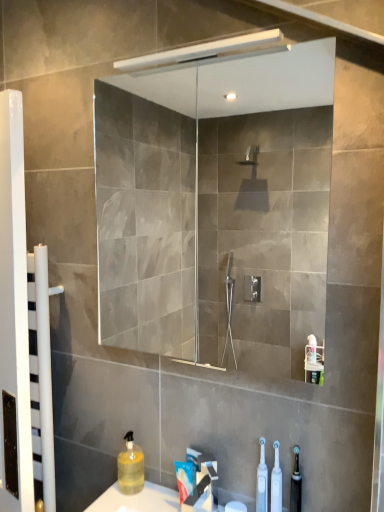
Question: Is white plastic toothbrushes at lower center, placed as the second toiletry when sorted from right to left, oriented towards transparent glass mirror at upper center?

Choices:
 (A) no
 (B) yes

Answer: (A)

Question: Considering the relative sizes of white plastic toothbrushes at lower center, acting as the first toiletry starting from the left, and transparent glass mirror at upper center in the image provided, is white plastic toothbrushes at lower center, acting as the first toiletry starting from the left, thinner than transparent glass mirror at upper center?

Choices:
 (A) no
 (B) yes

Answer: (B)

Question: From the image's perspective, is white plastic toothbrushes at lower center, acting as the first toiletry starting from the left, above transparent glass mirror at upper center?

Choices:
 (A) no
 (B) yes

Answer: (A)

Question: Is white plastic toothbrushes at lower center, acting as the first toiletry starting from the left, surrounding transparent glass mirror at upper center?

Choices:
 (A) no
 (B) yes

Answer: (A)

Question: Is white plastic toothbrushes at lower center, acting as the first toiletry starting from the left, placed right next to transparent glass mirror at upper center?

Choices:
 (A) yes
 (B) no

Answer: (B)

Question: Is white plastic toothbrushes at lower center, placed as the second toiletry when sorted from right to left, outside of transparent glass mirror at upper center?

Choices:
 (A) yes
 (B) no

Answer: (A)

Question: Is white glossy towel rack at left smaller than translucent yellow liquid at lower left, the first cleaning product in the back-to-front sequence?

Choices:
 (A) no
 (B) yes

Answer: (A)

Question: Is white glossy towel rack at left turned away from translucent yellow liquid at lower left, which appears as the second cleaning product when viewed from the front?

Choices:
 (A) yes
 (B) no

Answer: (B)

Question: Does white glossy towel rack at left have a greater width compared to translucent yellow liquid at lower left, which is counted as the 2th cleaning product, starting from the right?

Choices:
 (A) yes
 (B) no

Answer: (B)

Question: Can you confirm if white glossy towel rack at left is positioned to the right of translucent yellow liquid at lower left, which is counted as the 2th cleaning product, starting from the right?

Choices:
 (A) no
 (B) yes

Answer: (A)

Question: Can you confirm if white glossy towel rack at left is positioned to the left of translucent yellow liquid at lower left, marked as the 1th cleaning product in a left-to-right arrangement?

Choices:
 (A) yes
 (B) no

Answer: (A)

Question: From a real-world perspective, is white glossy towel rack at left on top of translucent yellow liquid at lower left, marked as the 1th cleaning product in a left-to-right arrangement?

Choices:
 (A) no
 (B) yes

Answer: (B)

Question: Could you tell me if transparent glass mirror at upper center is facing white glossy towel rack at left?

Choices:
 (A) no
 (B) yes

Answer: (A)